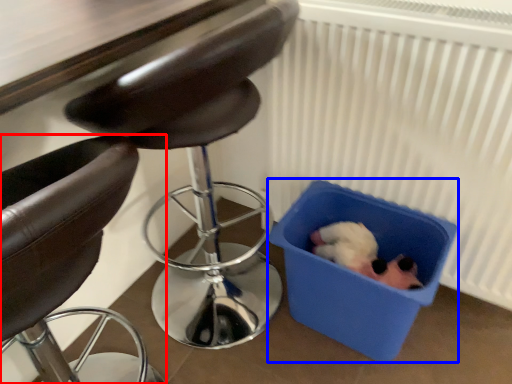
Question: Which point is further to the camera, chair (highlighted by a red box) or storage box (highlighted by a blue box)?

Choices:
 (A) chair
 (B) storage box

Answer: (B)